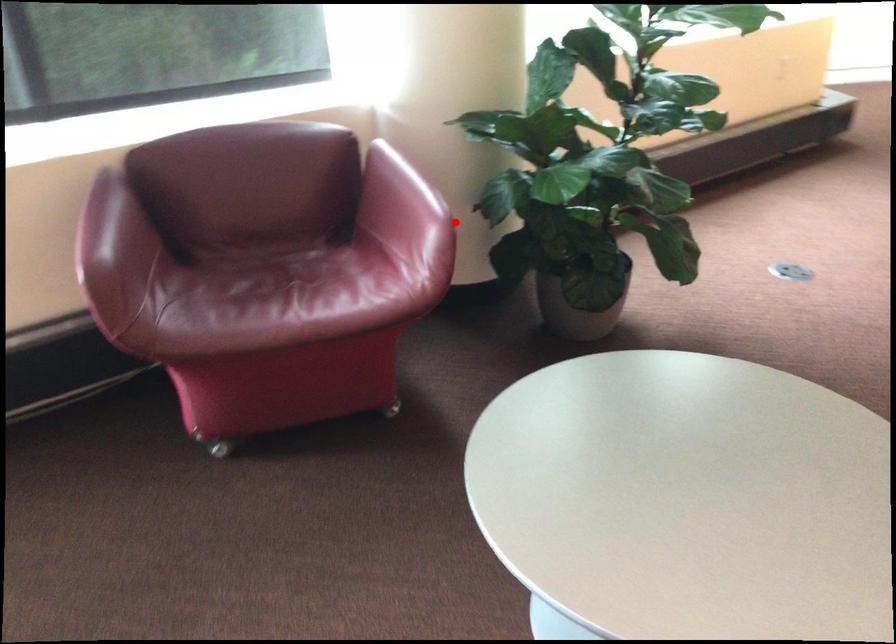
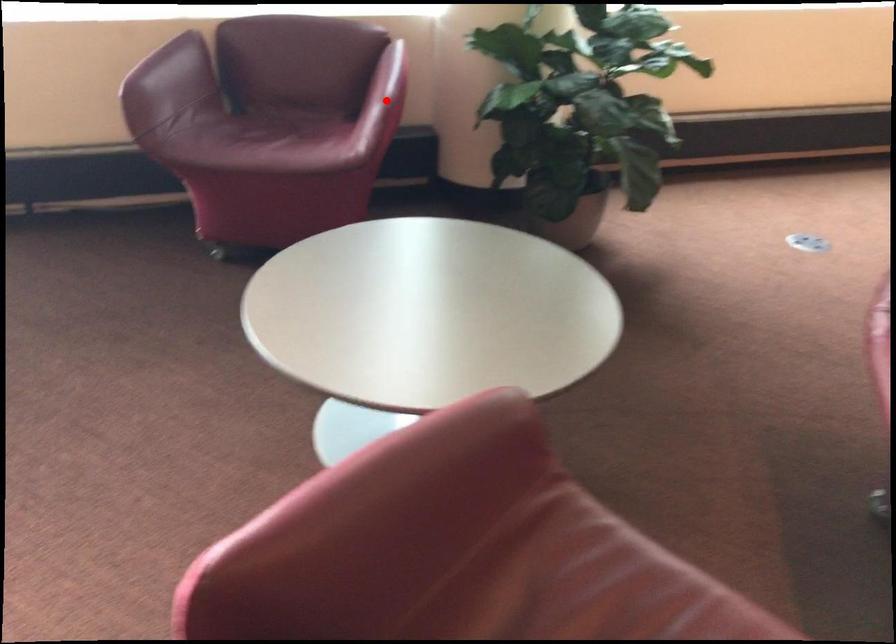
I am providing you with two images of the same scene from different viewpoints. A red point is marked on the first image and another point is marked on the second image. Does the point marked in image1 correspond to the same location as the one in image2?

Yes